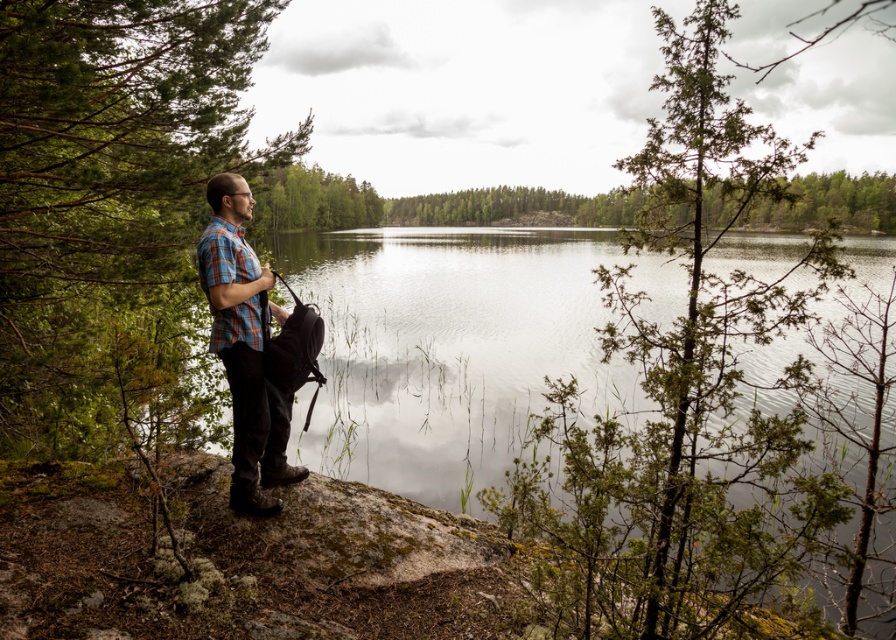
You are a photographer planning to take a portrait of the man in the scene. You want to ensure that the clear water at center and the plaid fabric shirt at center are both visible in the frame. Which object should you position closer to the foreground to achieve this?

The clear water at center is taller than plaid fabric shirt at center, so positioning the clear water at center closer to the foreground will ensure both objects are visible in the frame.

You are a photographer trying to capture the clear water at center and the plaid fabric shirt at center in the same frame. Based on their sizes, which object should you focus on first to ensure both are in focus?

The clear water at center is larger in size than the plaid fabric shirt at center, so focusing on the larger clear water at center first would help ensure both are in focus.